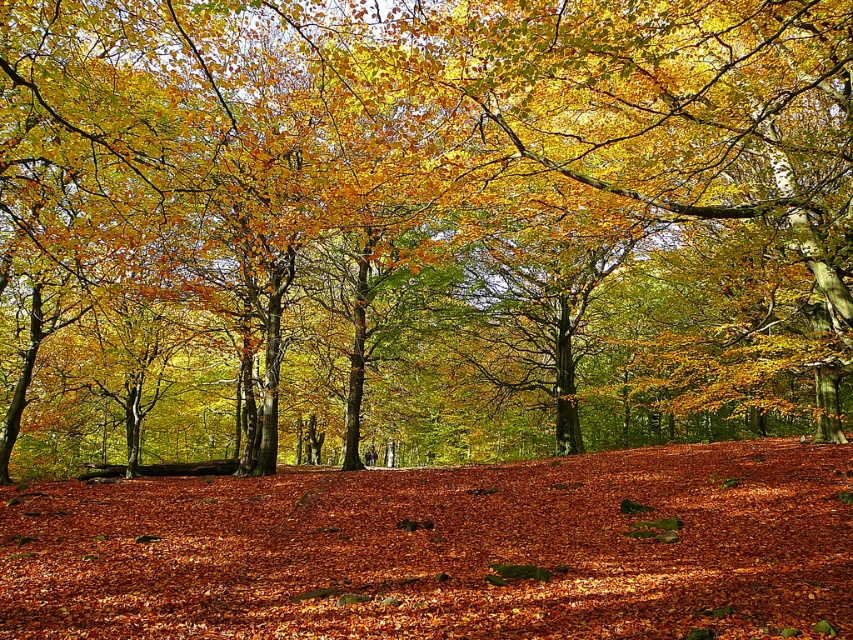
Based on the photo, you are a hiker who wants to place a small marker between the golden glossy leaves at center and the brown leaf litter at center. How far apart should you place the marker from each object?

The golden glossy leaves at center and brown leaf litter at center are 26.07 feet apart. To place the marker exactly halfway between them, you should position it 13.035 feet away from each object.

You are a hiker navigating through the autumnal forest depicted in the image. You notice two points marked on the ground. The first point is located at coordinates point (471,419), and the second point is at point (286,518). If you are standing at the first point, which direction should you move to reach the second point?

To move from point (471,419) to point (286,518), you should move northeast because the second point has a higher x and lower y coordinate than the first point.